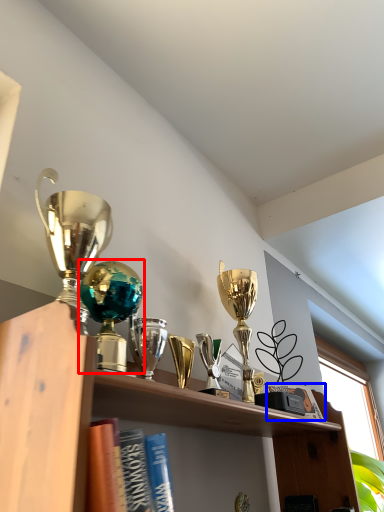
Question: Which of the following is the closest to the observer, trophy (highlighted by a red box) or book (highlighted by a blue box)?

Choices:
 (A) trophy
 (B) book

Answer: (A)